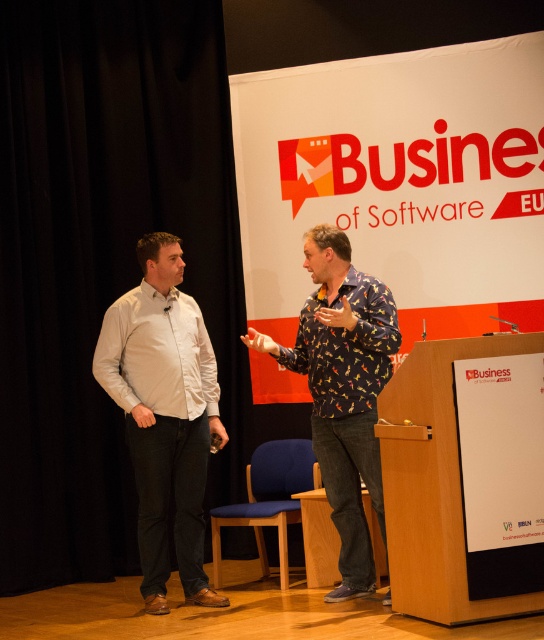
Question: In this image, where is white cotton shirt at left located relative to printed fabric shirt at center?

Choices:
 (A) below
 (B) above

Answer: (A)

Question: Is white cotton shirt at left below printed fabric shirt at center?

Choices:
 (A) no
 (B) yes

Answer: (B)

Question: Which point is farther from the camera taking this photo?

Choices:
 (A) (189, 481)
 (B) (363, 390)

Answer: (A)

Question: Which point is closer to the camera?

Choices:
 (A) white cotton shirt at left
 (B) printed fabric shirt at center

Answer: (B)

Question: Can you confirm if white cotton shirt at left is bigger than printed fabric shirt at center?

Choices:
 (A) yes
 (B) no

Answer: (B)